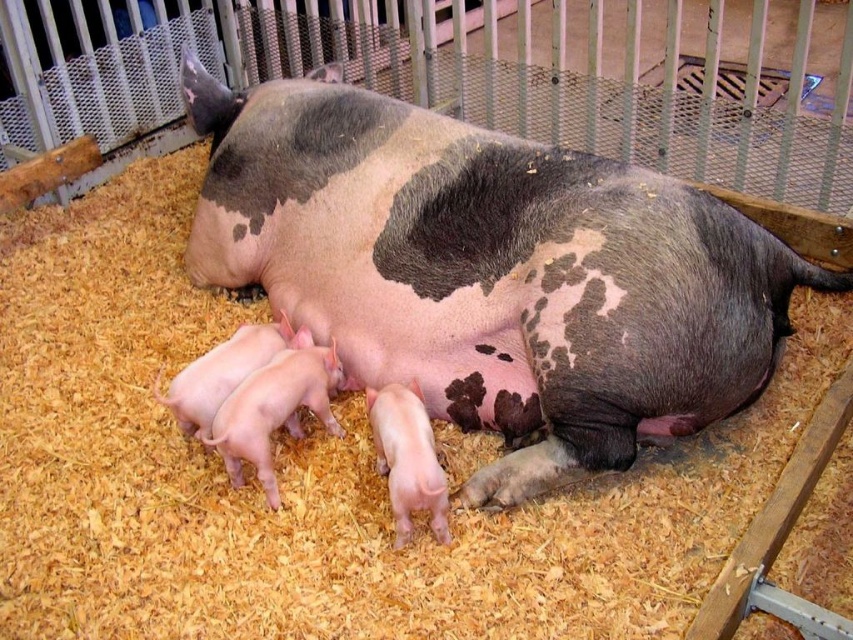
Question: Which point appears farthest from the camera in this image?

Choices:
 (A) (399, 524)
 (B) (312, 352)
 (C) (289, 92)

Answer: (C)

Question: Which object appears farthest from the camera in this image?

Choices:
 (A) speckled pink piglet at lower left
 (B) pink smooth piglet at lower center
 (C) pink smooth piglets at lower left

Answer: (A)

Question: Which object is farther from the camera taking this photo?

Choices:
 (A) pink smooth piglets at lower left
 (B) pink smooth piglet at lower center
 (C) speckled pink piglet at lower left

Answer: (C)

Question: Does pink smooth piglets at lower left appear on the right side of pink smooth piglet at lower center?

Choices:
 (A) yes
 (B) no

Answer: (B)

Question: Can you confirm if speckled pink piglet at lower left is positioned above pink smooth piglet at lower center?

Choices:
 (A) no
 (B) yes

Answer: (B)

Question: Is speckled pink piglet at lower left above pink smooth piglet at lower center?

Choices:
 (A) yes
 (B) no

Answer: (A)